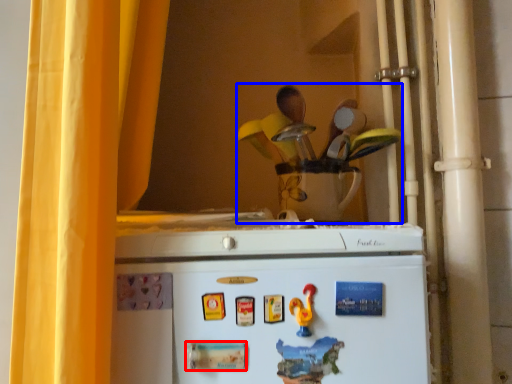
Question: Which object appears farthest to the camera in this image, magnet (highlighted by a red box) or toy (highlighted by a blue box)?

Choices:
 (A) magnet
 (B) toy

Answer: (B)